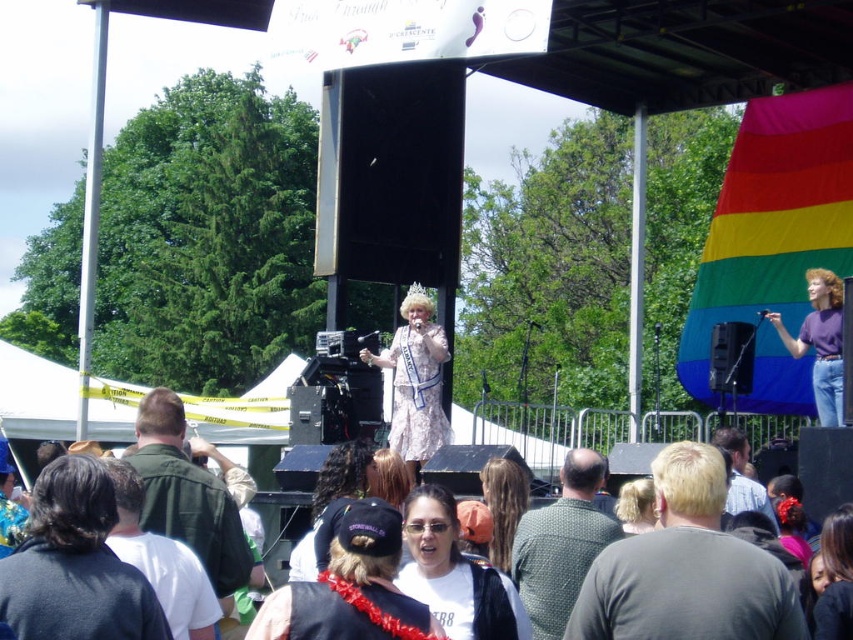
Can you confirm if gray matte shirt at center is smaller than black leather baseball cap at lower center?

No.

Between point (701, 563) and point (329, 548), which one is positioned in front?

Point (701, 563) is in front.

Is point (598, 605) closer to camera compared to point (358, 614)?

That is False.

The image size is (853, 640). In order to click on gray matte shirt at center in this screenshot , I will do `click(686, 568)`.

Is point (364, 579) more distant than point (647, 481)?

No, it is not.

Does black leather baseball cap at lower center appear on the left side of blonde hair at center?

Indeed, black leather baseball cap at lower center is positioned on the left side of blonde hair at center.

Who is more distant from viewer, (276, 627) or (637, 502)?

The point (637, 502) is behind.

I want to click on black leather baseball cap at lower center, so click(350, 588).

Can you confirm if white cotton shirt at lower left is shorter than purple cotton shirt at upper right?

Correct, white cotton shirt at lower left is not as tall as purple cotton shirt at upper right.

Which is more to the right, white cotton shirt at lower left or purple cotton shirt at upper right?

purple cotton shirt at upper right

Does point (115, 536) come closer to viewer compared to point (819, 394)?

Yes, point (115, 536) is closer to viewer.

Identify the location of white cotton shirt at lower left. (161, 561).